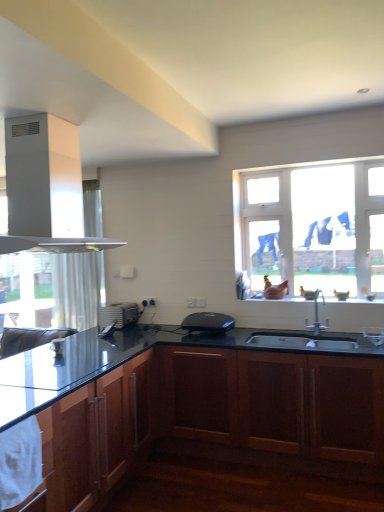
The image size is (384, 512). What do you see at coordinates (192, 401) in the screenshot? I see `dark wood cabinet at lower center, acting as the 2th cabinetry starting from the left` at bounding box center [192, 401].

This screenshot has height=512, width=384. What do you see at coordinates (208, 323) in the screenshot?
I see `black plastic toaster at center, the 2th appliance in the back-to-front sequence` at bounding box center [208, 323].

I want to click on black plastic toaster at center, the second appliance from the left, so click(x=208, y=323).

This screenshot has height=512, width=384. I want to click on white matte gas stove at upper left, so click(45, 187).

Image resolution: width=384 pixels, height=512 pixels. What do you see at coordinates (316, 315) in the screenshot?
I see `silver metallic faucet at center` at bounding box center [316, 315].

What do you see at coordinates (311, 225) in the screenshot? This screenshot has width=384, height=512. I see `clear glass window at upper right` at bounding box center [311, 225].

Where is `satin silver toaster at lower center, which is the second appliance from right to left`? The width and height of the screenshot is (384, 512). satin silver toaster at lower center, which is the second appliance from right to left is located at coordinates (119, 314).

From their relative heights in the image, would you say silver metallic faucet at center is taller or shorter than dark wood cabinet at lower center, acting as the 2th cabinetry starting from the left?

Clearly, silver metallic faucet at center is shorter compared to dark wood cabinet at lower center, acting as the 2th cabinetry starting from the left.

In terms of width, does silver metallic faucet at center look wider or thinner when compared to dark wood cabinet at lower center, the 1th cabinetry in the right-to-left sequence?

Considering their sizes, silver metallic faucet at center looks slimmer than dark wood cabinet at lower center, the 1th cabinetry in the right-to-left sequence.

Is the depth of silver metallic faucet at center greater than that of dark wood cabinet at lower center, the 1th cabinetry in the right-to-left sequence?

Yes, it is.

Is silver metallic faucet at center directly adjacent to dark wood cabinet at lower center, the 1th cabinetry in the right-to-left sequence?

No, silver metallic faucet at center is not touching dark wood cabinet at lower center, the 1th cabinetry in the right-to-left sequence.

Does clear glass window at upper right have a smaller size compared to glossy wood cabinet at lower left, the first cabinetry viewed from the left?

Indeed, clear glass window at upper right has a smaller size compared to glossy wood cabinet at lower left, the first cabinetry viewed from the left.

Considering the sizes of objects clear glass window at upper right and glossy wood cabinet at lower left, the first cabinetry viewed from the left, in the image provided, who is wider, clear glass window at upper right or glossy wood cabinet at lower left, the first cabinetry viewed from the left,?

glossy wood cabinet at lower left, the first cabinetry viewed from the left.

From the picture: How different are the orientations of clear glass window at upper right and glossy wood cabinet at lower left, acting as the 2th cabinetry starting from the right, in degrees?

The angle between the facing direction of clear glass window at upper right and the facing direction of glossy wood cabinet at lower left, acting as the 2th cabinetry starting from the right, is 91.3 degrees.

From the image's perspective, between clear glass window at upper right and glossy wood cabinet at lower left, acting as the 2th cabinetry starting from the right, which one is located above?

clear glass window at upper right.

Looking at the image, does clear glass window at upper right seem bigger or smaller compared to silver metallic faucet at center?

In the image, clear glass window at upper right appears to be larger than silver metallic faucet at center.

Does clear glass window at upper right appear on the right side of silver metallic faucet at center?

Yes, clear glass window at upper right is to the right of silver metallic faucet at center.

Is clear glass window at upper right far away from silver metallic faucet at center?

No, clear glass window at upper right is in close proximity to silver metallic faucet at center.

Can you confirm if clear glass window at upper right is shorter than silver metallic faucet at center?

No, clear glass window at upper right is not shorter than silver metallic faucet at center.

Which is more to the right, dark wood cabinet at lower center, the 1th cabinetry in the right-to-left sequence, or white matte gas stove at upper left?

From the viewer's perspective, dark wood cabinet at lower center, the 1th cabinetry in the right-to-left sequence, appears more on the right side.

Consider the image. From a real-world perspective, which is physically below, dark wood cabinet at lower center, acting as the 2th cabinetry starting from the left, or white matte gas stove at upper left?

dark wood cabinet at lower center, acting as the 2th cabinetry starting from the left, is physically lower.

Choose the correct answer: Is dark wood cabinet at lower center, the 1th cabinetry in the right-to-left sequence, inside white matte gas stove at upper left or outside it?

dark wood cabinet at lower center, the 1th cabinetry in the right-to-left sequence, is not inside white matte gas stove at upper left, it's outside.

How different are the orientations of dark wood cabinet at lower center, the 1th cabinetry in the right-to-left sequence, and white matte gas stove at upper left in degrees?

90.3 degrees.

How far apart are white matte gas stove at upper left and matte glass window sill at center?

They are 1.96 meters apart.

Consider the image. From a real-world perspective, who is located higher, white matte gas stove at upper left or matte glass window sill at center?

white matte gas stove at upper left, from a real-world perspective.

Is white matte gas stove at upper left looking in the opposite direction of matte glass window sill at center?

No, white matte gas stove at upper left is not facing the opposite direction of matte glass window sill at center.

Is white matte gas stove at upper left shorter than matte glass window sill at center?

No.

Is clear glass window at upper right next to matte glass window sill at center and touching it?

No, clear glass window at upper right is not in contact with matte glass window sill at center.

Who is taller, clear glass window at upper right or matte glass window sill at center?

With more height is clear glass window at upper right.

Which object is more forward, clear glass window at upper right or matte glass window sill at center?

matte glass window sill at center.

Which object is positioned more to the left, clear glass window at upper right or matte glass window sill at center?

Positioned to the left is matte glass window sill at center.

Is black plastic toaster at center, the first appliance in the front-to-back sequence, bigger than dark wood cabinet at lower center, the 1th cabinetry in the right-to-left sequence?

No.

From a real-world perspective, is black plastic toaster at center, the first appliance in the front-to-back sequence, above or below dark wood cabinet at lower center, the 1th cabinetry in the right-to-left sequence?

Clearly, from a real-world perspective, black plastic toaster at center, the first appliance in the front-to-back sequence, is above dark wood cabinet at lower center, the 1th cabinetry in the right-to-left sequence.

Locate an element on the screen. The width and height of the screenshot is (384, 512). the 1st cabinetry counting from the left side of the black plastic toaster at center, the 2th appliance in the back-to-front sequence is located at coordinates (192, 401).

From their relative heights in the image, would you say black plastic toaster at center, the second appliance from the left, is taller or shorter than dark wood cabinet at lower center, the 1th cabinetry in the right-to-left sequence?

black plastic toaster at center, the second appliance from the left, is shorter than dark wood cabinet at lower center, the 1th cabinetry in the right-to-left sequence.

What are the coordinates of `the 1st cabinetry below the silver metallic faucet at center (from the image's perspective)` in the screenshot? It's located at (192, 401).

Locate an element on the screen. This screenshot has width=384, height=512. cabinetry that is the 2nd object directly below the clear glass window at upper right (from a real-world perspective) is located at coordinates (94, 435).

In the scene shown: Estimate the real-world distances between objects in this image. Which object is further from clear glass window at upper right, dark wood cabinet at lower center, the 1th cabinetry in the right-to-left sequence, or satin silver toaster at lower center, positioned as the 1th appliance in back-to-front order?

satin silver toaster at lower center, positioned as the 1th appliance in back-to-front order, is positioned further to the anchor clear glass window at upper right.

When comparing their distances from silver metallic faucet at center, does matte glass window sill at center or dark wood cabinet at lower center, acting as the 2th cabinetry starting from the left, seem closer?

The object closer to silver metallic faucet at center is matte glass window sill at center.

From the image, which object appears to be nearer to white matte gas stove at upper left, dark wood cabinet at lower center, acting as the 2th cabinetry starting from the left, or matte glass window sill at center?

dark wood cabinet at lower center, acting as the 2th cabinetry starting from the left.

Looking at the image, which one is located further to silver metallic faucet at center, matte glass window sill at center or black plastic toaster at center, the first appliance in the front-to-back sequence?

black plastic toaster at center, the first appliance in the front-to-back sequence, is positioned further to the anchor silver metallic faucet at center.

Which object lies further to the anchor point glossy wood cabinet at lower left, acting as the 2th cabinetry starting from the right, silver metallic faucet at center or matte glass window sill at center?

silver metallic faucet at center is further to glossy wood cabinet at lower left, acting as the 2th cabinetry starting from the right.

Estimate the real-world distances between objects in this image. Which object is further from dark wood cabinet at lower center, acting as the 2th cabinetry starting from the left, white matte gas stove at upper left or satin silver toaster at lower center, positioned as the 1th appliance in back-to-front order?

satin silver toaster at lower center, positioned as the 1th appliance in back-to-front order, is further to dark wood cabinet at lower center, acting as the 2th cabinetry starting from the left.

Looking at the image, which one is located further to dark wood cabinet at lower center, the 1th cabinetry in the right-to-left sequence, glossy wood cabinet at lower left, the first cabinetry viewed from the left, or black plastic toaster at center, the second appliance from the left?

black plastic toaster at center, the second appliance from the left, lies further to dark wood cabinet at lower center, the 1th cabinetry in the right-to-left sequence, than the other object.

Which object lies nearer to the anchor point white matte gas stove at upper left, matte glass window sill at center or clear glass window at upper right?

clear glass window at upper right.

This screenshot has height=512, width=384. Identify the location of cabinetry that lies between white matte gas stove at upper left and glossy wood cabinet at lower left, acting as the 2th cabinetry starting from the right, from top to bottom. (192, 401).

Locate an element on the screen. Image resolution: width=384 pixels, height=512 pixels. appliance between dark wood cabinet at lower center, acting as the 2th cabinetry starting from the left, and matte glass window sill at center in the front-back direction is located at coordinates [x=208, y=323].

Find the location of a particular element. Image resolution: width=384 pixels, height=512 pixels. window sill between white matte gas stove at upper left and clear glass window at upper right in the horizontal direction is located at coordinates (355, 298).

I want to click on gas stove between dark wood cabinet at lower center, the 1th cabinetry in the right-to-left sequence, and matte glass window sill at center from front to back, so pos(45,187).